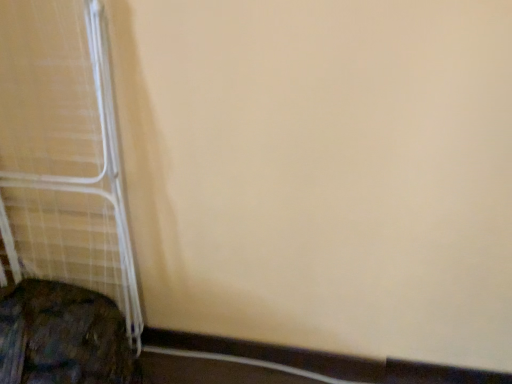
This screenshot has height=384, width=512. I want to click on white mesh curtain at left, so click(x=63, y=153).

The width and height of the screenshot is (512, 384). What do you see at coordinates (63, 153) in the screenshot? I see `white mesh curtain at left` at bounding box center [63, 153].

Identify the location of white mesh curtain at left. The image size is (512, 384). (63, 153).